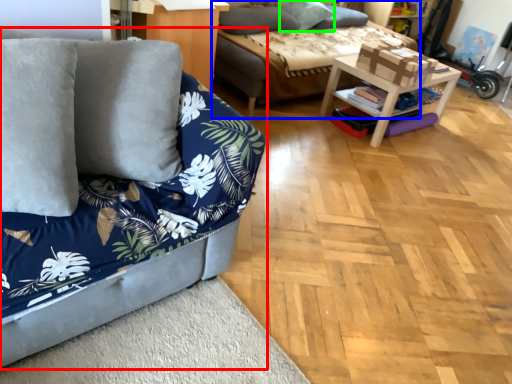
Question: Which is nearer to the studio couch (highlighted by a red box)? studio couch (highlighted by a blue box) or pillow (highlighted by a green box).

Choices:
 (A) studio couch
 (B) pillow

Answer: (A)